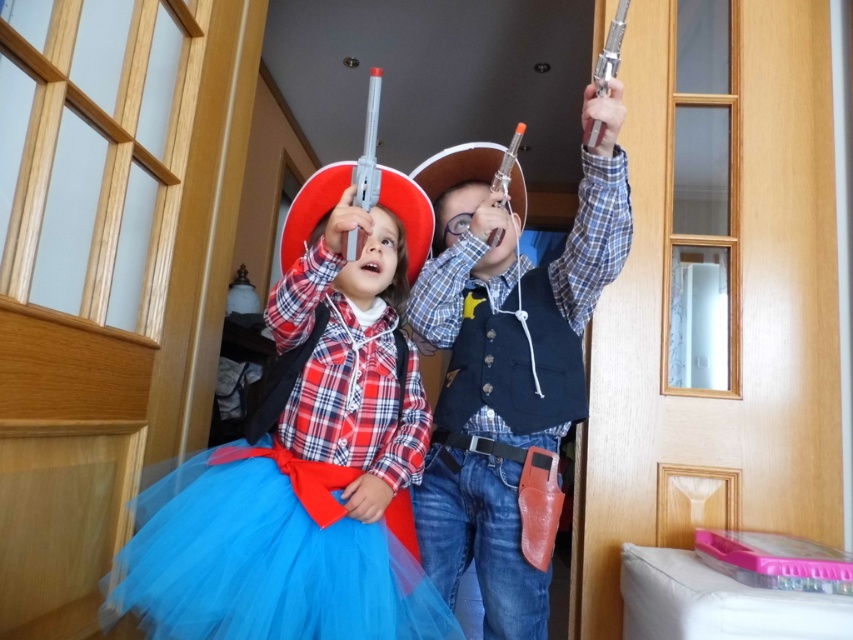
Question: Which of these objects is positioned closest to the blue tulle ballet skirt at lower center?

Choices:
 (A) matte red cowboy hat at upper center
 (B) matte plastic toy gun at center

Answer: (A)

Question: Which point is farther from the camera taking this photo?

Choices:
 (A) click(450, 612)
 (B) click(537, 288)
 (C) click(259, 481)

Answer: (B)

Question: Estimate the real-world distances between objects in this image. Which object is farther from the matte red cowboy hat at upper center?

Choices:
 (A) blue tulle ballet skirt at lower center
 (B) matte plastic toy gun at center

Answer: (B)

Question: Does matte red cowboy hat at upper center have a larger size compared to blue tulle ballet skirt at lower center?

Choices:
 (A) yes
 (B) no

Answer: (A)

Question: Observing the image, what is the correct spatial positioning of matte plastic toy gun at center in reference to blue tulle ballet skirt at lower center?

Choices:
 (A) left
 (B) right

Answer: (B)

Question: Is matte red cowboy hat at upper center behind blue tulle ballet skirt at lower center?

Choices:
 (A) yes
 (B) no

Answer: (A)